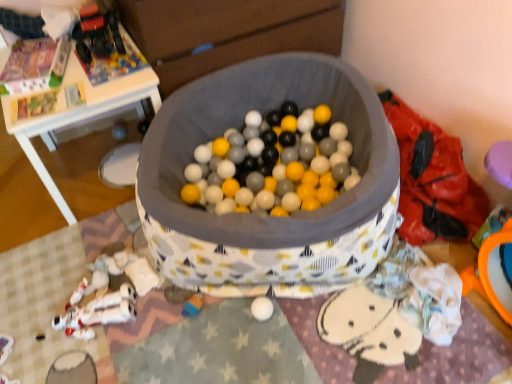
Image resolution: width=512 pixels, height=384 pixels. Find the location of `vacant space behind white plastic toy at lower left, the 2th toy ordered from the bottom`. vacant space behind white plastic toy at lower left, the 2th toy ordered from the bottom is located at coordinates (92, 254).